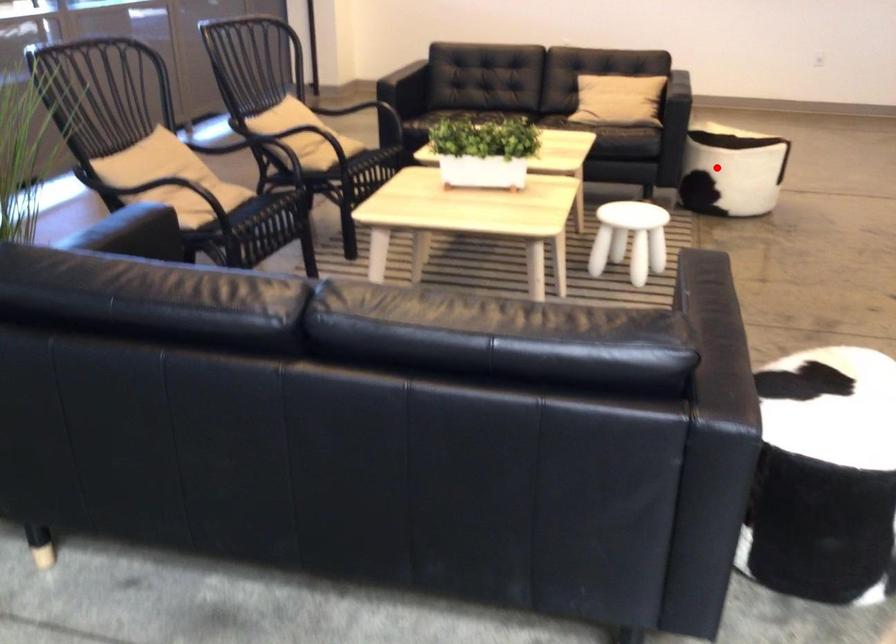
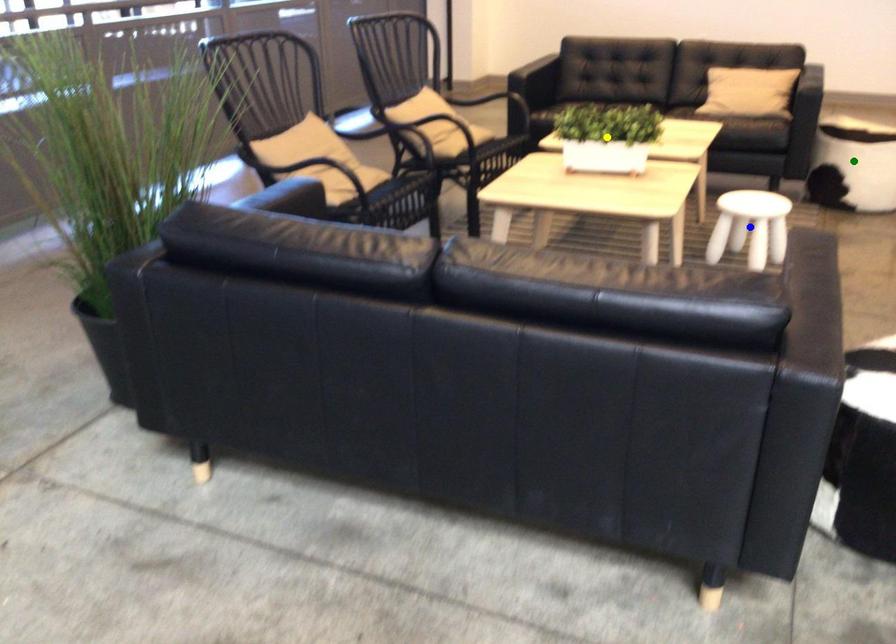
Question: I am providing you with two images of the same scene from different viewpoints. A red point is marked on the first image. You are given multiple points on the second image. In image 2, which mark is for the same physical point as the one in image 1?

Choices:
 (A) yellow point
 (B) green point
 (C) blue point

Answer: (B)